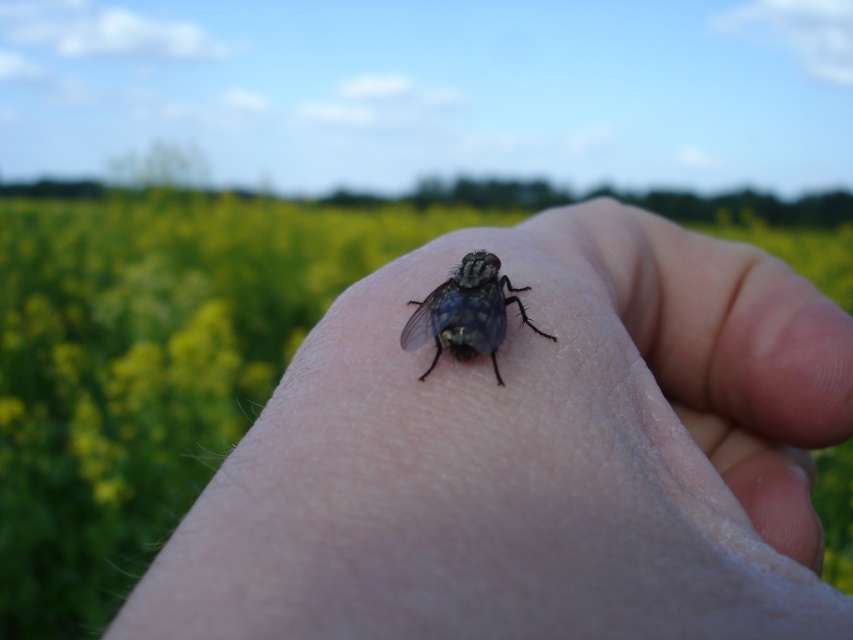
Is smooth skin hand at center positioned in front of shiny metallic fly at center?

Yes.

Is smooth skin hand at center to the right of shiny metallic fly at center from the viewer's perspective?

Correct, you'll find smooth skin hand at center to the right of shiny metallic fly at center.

Which is behind, point (630, 282) or point (486, 301)?

The point (630, 282) is behind.

The width and height of the screenshot is (853, 640). In order to click on smooth skin hand at center in this screenshot , I will do `click(534, 456)`.